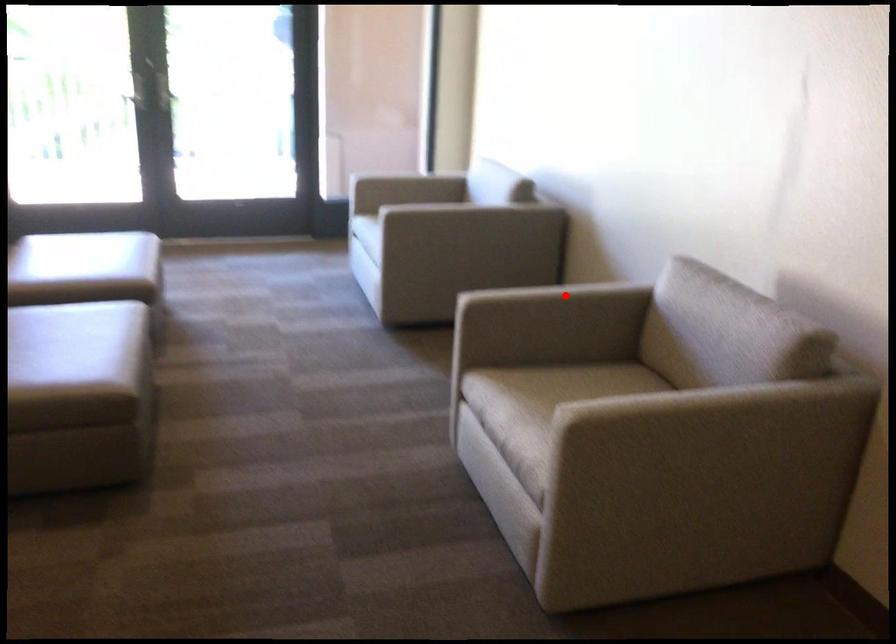
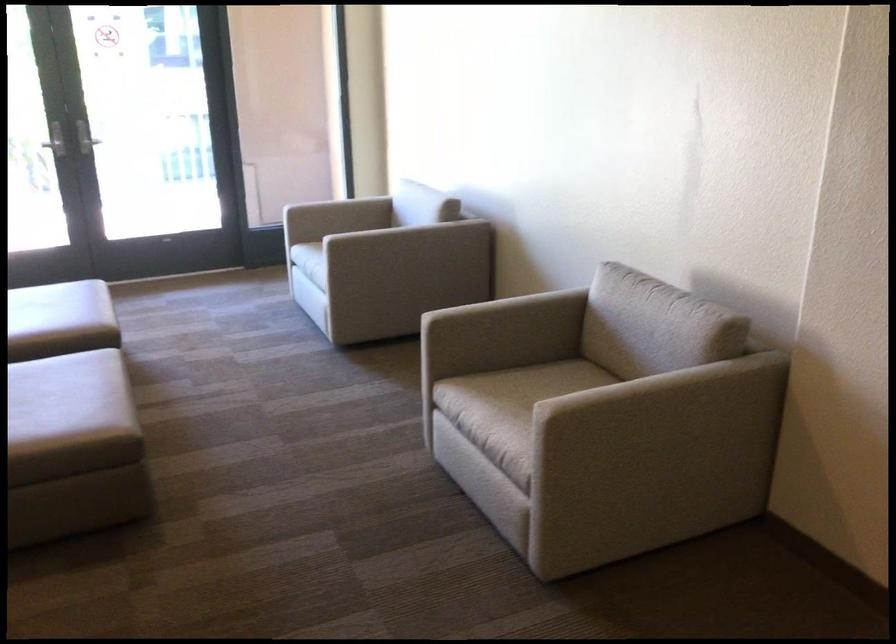
Question: I am providing you with two images of the same scene from different viewpoints. In image1, a red point is highlighted. Considering the same 3D point in image2, which of the following is correct?

Choices:
 (A) It is closer
 (B) It is farther

Answer: (B)